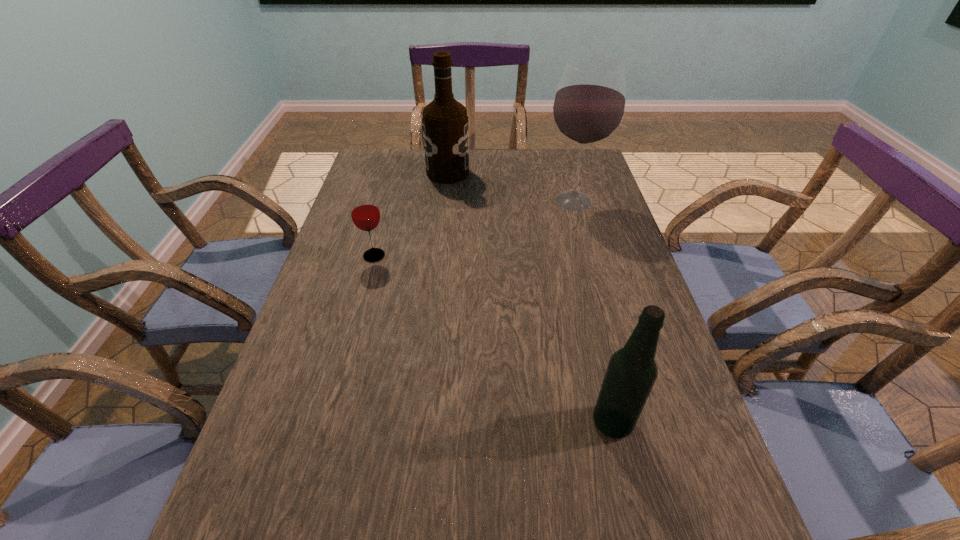
Select which alcohol appears as the closest to the nearest alcohol. Please provide its 2D coordinates. Your answer should be formatted as a tuple, i.e. [(x, y)], where the tuple contains the x and y coordinates of a point satisfying the conditions above.

[(589, 105)]

Identify which alcohol is the closest to the second shortest object. Please provide its 2D coordinates. Your answer should be formatted as a tuple, i.e. [(x, y)], where the tuple contains the x and y coordinates of a point satisfying the conditions above.

[(589, 105)]

You are a GUI agent. You are given a task and a screenshot of the screen. Output one action in this format:
    pyautogui.click(x=<x>, y=<y>)
    Task: Click on the vacant space that satisfies the following two spatial constraints: 1. on the label of the shortest alcohol; 2. on the left side of the third object from right to left
    This screenshot has height=540, width=960.
    Given the screenshot: What is the action you would take?
    422,422

The width and height of the screenshot is (960, 540). Find the location of `vacant area in the image that satisfies the following two spatial constraints: 1. on the label of the farthest object; 2. on the front side of the leftmost object`. vacant area in the image that satisfies the following two spatial constraints: 1. on the label of the farthest object; 2. on the front side of the leftmost object is located at coordinates (440, 255).

In order to click on vacant space that satisfies the following two spatial constraints: 1. on the label of the farthest object; 2. on the left side of the second nearest alcohol in this screenshot , I will do `click(445, 201)`.

At what (x,y) coordinates should I click in order to perform the action: click on free location that satisfies the following two spatial constraints: 1. on the label of the leftmost alcohol; 2. on the right side of the third nearest object. Please return your answer as a coordinate pair (x, y). The height and width of the screenshot is (540, 960). Looking at the image, I should click on (445, 201).

This screenshot has height=540, width=960. What are the coordinates of `free region that satisfies the following two spatial constraints: 1. on the back side of the second farthest alcohol; 2. on the label of the second object from left to right` in the screenshot? It's located at (565, 173).

What are the coordinates of `vacant area that satisfies the following two spatial constraints: 1. on the back side of the nearest object; 2. on the label of the third object from right to left` in the screenshot? It's located at [553, 173].